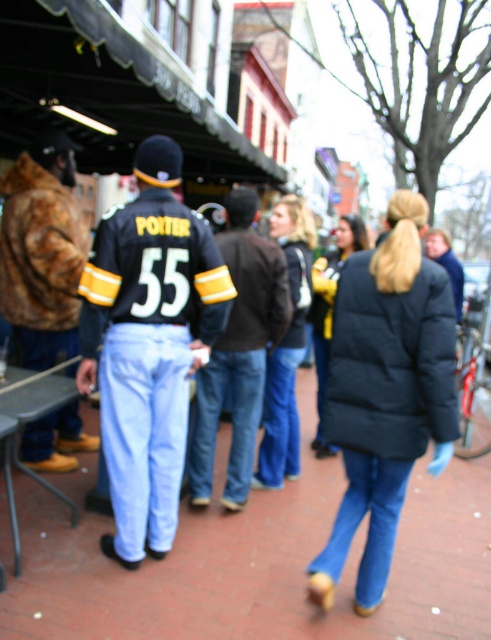
Can you confirm if black jersey at center is shorter than fur coat at left?

Incorrect, black jersey at center's height does not fall short of fur coat at left's.

Between point (119, 269) and point (5, 205), which one is positioned in front?

Point (119, 269) is in front.

Locate an element on the screen. The width and height of the screenshot is (491, 640). black jersey at center is located at coordinates (148, 344).

Between blue jeans at center and dark blue jeans at center, which one appears on the left side from the viewer's perspective?

Positioned to the left is dark blue jeans at center.

Based on the photo, who is taller, blue jeans at center or dark blue jeans at center?

dark blue jeans at center is taller.

Does point (268, 589) come farther from viewer compared to point (285, 262)?

No, it is in front of (285, 262).

Where is `blue jeans at center`? The width and height of the screenshot is (491, 640). blue jeans at center is located at coordinates (256, 561).

The image size is (491, 640). In order to click on black matte jacket at center in this screenshot , I will do `click(156, 349)`.

Is point (153, 189) in front of point (227, 499)?

Yes, point (153, 189) is closer to viewer.

Describe the element at coordinates (156, 349) in the screenshot. I see `black matte jacket at center` at that location.

Find the location of a particular element. This screenshot has height=640, width=491. black matte jacket at center is located at coordinates (156, 349).